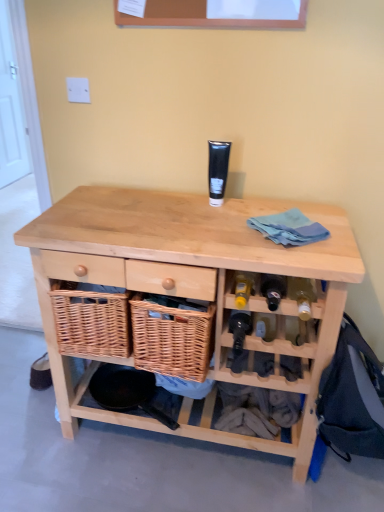
Question: Could you tell me if translucent glass wine bottle at lower right, the first wine bottle from the top, is facing black matte tube at center?

Choices:
 (A) no
 (B) yes

Answer: (A)

Question: Does translucent glass wine bottle at lower right, arranged as the second wine bottle when ordered from the bottom, have a smaller size compared to black matte tube at center?

Choices:
 (A) no
 (B) yes

Answer: (A)

Question: Can you confirm if translucent glass wine bottle at lower right, the first wine bottle from the top, is taller than black matte tube at center?

Choices:
 (A) no
 (B) yes

Answer: (A)

Question: Considering the relative sizes of translucent glass wine bottle at lower right, arranged as the second wine bottle when ordered from the bottom, and black matte tube at center in the image provided, is translucent glass wine bottle at lower right, arranged as the second wine bottle when ordered from the bottom, wider than black matte tube at center?

Choices:
 (A) yes
 (B) no

Answer: (A)

Question: Are translucent glass wine bottle at lower right, the 1th wine bottle viewed from the right, and black matte tube at center far apart?

Choices:
 (A) yes
 (B) no

Answer: (B)

Question: Does translucent glass wine bottle at lower right, the first wine bottle from the top, have a lesser width compared to black matte tube at center?

Choices:
 (A) yes
 (B) no

Answer: (B)

Question: Can you confirm if shiny dark glass wine bottle at center, placed as the 1th wine bottle when sorted from left to right, is smaller than white painted wood door at left?

Choices:
 (A) no
 (B) yes

Answer: (B)

Question: From the image's perspective, does shiny dark glass wine bottle at center, positioned as the first wine bottle in bottom-to-top order, appear higher than white painted wood door at left?

Choices:
 (A) yes
 (B) no

Answer: (B)

Question: From the image's perspective, is shiny dark glass wine bottle at center, positioned as the first wine bottle in bottom-to-top order, beneath white painted wood door at left?

Choices:
 (A) yes
 (B) no

Answer: (A)

Question: From a real-world perspective, is shiny dark glass wine bottle at center, placed as the 1th wine bottle when sorted from left to right, positioned under white painted wood door at left based on gravity?

Choices:
 (A) no
 (B) yes

Answer: (B)

Question: Is shiny dark glass wine bottle at center, which appears as the second wine bottle when viewed from the right, behind white painted wood door at left?

Choices:
 (A) yes
 (B) no

Answer: (B)

Question: Would you say white painted wood door at left is part of shiny dark glass wine bottle at center, which appears as the second wine bottle when viewed from the right,'s contents?

Choices:
 (A) yes
 (B) no

Answer: (B)

Question: Does translucent glass wine bottle at lower right, the first wine bottle from the top, have a greater width compared to white painted wood door at left?

Choices:
 (A) yes
 (B) no

Answer: (A)